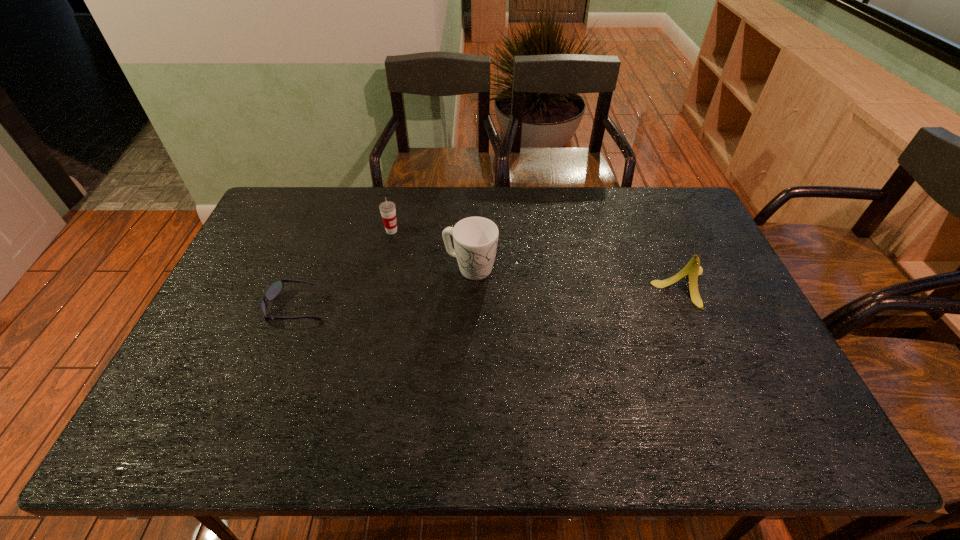
This screenshot has height=540, width=960. Find the location of `the leftmost object`. the leftmost object is located at coordinates (274, 289).

The height and width of the screenshot is (540, 960). I want to click on the shortest object, so click(x=274, y=289).

At what (x,y) coordinates should I click in order to perform the action: click on the rightmost object. Please return your answer as a coordinate pair (x, y). The width and height of the screenshot is (960, 540). Looking at the image, I should click on (693, 269).

Locate an element on the screen. This screenshot has height=540, width=960. cup is located at coordinates (387, 209).

Find the location of `the third object from right to left`. the third object from right to left is located at coordinates (387, 209).

Find the location of `the third object from left to right`. the third object from left to right is located at coordinates (475, 239).

The width and height of the screenshot is (960, 540). What are the coordinates of `free space located on the front of the banana` in the screenshot? It's located at (707, 346).

This screenshot has width=960, height=540. What are the coordinates of `vacant region located 0.160m on the side of the cup with the logo` in the screenshot? It's located at (438, 250).

Identify the location of vacant space situated on the side of the cup with the logo. This screenshot has width=960, height=540. (456, 258).

Image resolution: width=960 pixels, height=540 pixels. In order to click on vacant space located 0.140m on the side of the cup with the logo in this screenshot , I will do `click(432, 248)`.